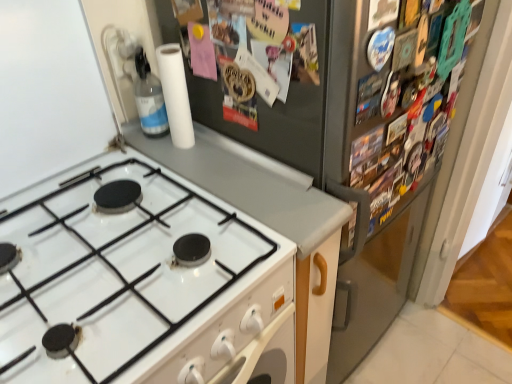
Question: Is white matte countertop at center taller than white glossy gas stove at lower left?

Choices:
 (A) no
 (B) yes

Answer: (B)

Question: Can you confirm if white matte countertop at center is bigger than white glossy gas stove at lower left?

Choices:
 (A) no
 (B) yes

Answer: (B)

Question: Is white matte countertop at center shorter than white glossy gas stove at lower left?

Choices:
 (A) no
 (B) yes

Answer: (A)

Question: From the image's perspective, is white matte countertop at center over white glossy gas stove at lower left?

Choices:
 (A) no
 (B) yes

Answer: (A)

Question: Is white matte countertop at center to the left of white glossy gas stove at lower left from the viewer's perspective?

Choices:
 (A) no
 (B) yes

Answer: (A)

Question: Is the position of white matte countertop at center more distant than that of white glossy gas stove at lower left?

Choices:
 (A) no
 (B) yes

Answer: (B)

Question: From the image's perspective, does white matte paper towel at upper center appear higher than white glossy gas stove at lower left?

Choices:
 (A) yes
 (B) no

Answer: (A)

Question: Does white matte paper towel at upper center have a larger size compared to white glossy gas stove at lower left?

Choices:
 (A) yes
 (B) no

Answer: (B)

Question: Is white matte paper towel at upper center thinner than white glossy gas stove at lower left?

Choices:
 (A) yes
 (B) no

Answer: (A)

Question: Is white matte paper towel at upper center shorter than white glossy gas stove at lower left?

Choices:
 (A) no
 (B) yes

Answer: (A)

Question: From a real-world perspective, does white matte paper towel at upper center stand above white glossy gas stove at lower left?

Choices:
 (A) no
 (B) yes

Answer: (B)

Question: Could you tell me if white matte paper towel at upper center is facing white glossy gas stove at lower left?

Choices:
 (A) yes
 (B) no

Answer: (B)

Question: Can you confirm if transparent plastic bottle at upper left is shorter than satin silver fridge at upper right?

Choices:
 (A) no
 (B) yes

Answer: (B)